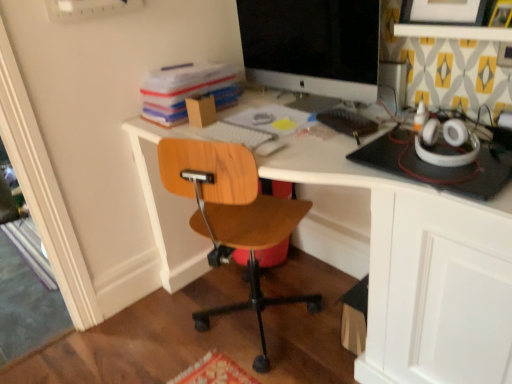
Question: Is white glossy desk at center thinner than satin black monitor at upper center?

Choices:
 (A) yes
 (B) no

Answer: (B)

Question: Is white glossy desk at center bigger than satin black monitor at upper center?

Choices:
 (A) no
 (B) yes

Answer: (B)

Question: From a real-world perspective, is white glossy desk at center located beneath satin black monitor at upper center?

Choices:
 (A) no
 (B) yes

Answer: (B)

Question: Does white glossy desk at center appear on the left side of satin black monitor at upper center?

Choices:
 (A) no
 (B) yes

Answer: (A)

Question: From the image's perspective, is white glossy desk at center beneath satin black monitor at upper center?

Choices:
 (A) yes
 (B) no

Answer: (A)

Question: Choose the correct answer: Is satin black monitor at upper center inside matte black picture frame at upper right or outside it?

Choices:
 (A) outside
 (B) inside

Answer: (A)

Question: In terms of width, does satin black monitor at upper center look wider or thinner when compared to matte black picture frame at upper right?

Choices:
 (A) wide
 (B) thin

Answer: (A)

Question: Relative to matte black picture frame at upper right, is satin black monitor at upper center in front or behind?

Choices:
 (A) front
 (B) behind

Answer: (B)

Question: Considering the positions of point (274, 29) and point (440, 13), is point (274, 29) closer or farther from the camera than point (440, 13)?

Choices:
 (A) closer
 (B) farther

Answer: (B)

Question: Relative to wooden chair at center, is white glossy desk at center in front or behind?

Choices:
 (A) behind
 (B) front

Answer: (B)

Question: From their relative heights in the image, would you say white glossy desk at center is taller or shorter than wooden chair at center?

Choices:
 (A) tall
 (B) short

Answer: (A)

Question: In terms of width, does white glossy desk at center look wider or thinner when compared to wooden chair at center?

Choices:
 (A) wide
 (B) thin

Answer: (A)

Question: Choose the correct answer: Is white glossy desk at center inside wooden chair at center or outside it?

Choices:
 (A) inside
 (B) outside

Answer: (B)

Question: In the image, is stacked paperboard at upper left on the left side or the right side of satin black monitor at upper center?

Choices:
 (A) right
 (B) left

Answer: (B)

Question: Is point (217, 72) closer or farther from the camera than point (286, 21)?

Choices:
 (A) farther
 (B) closer

Answer: (A)